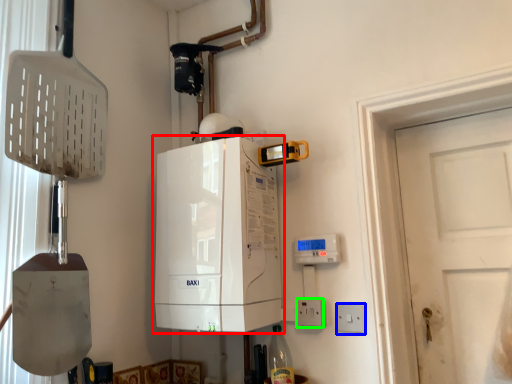
Question: Which object is positioned closest to home appliance (highlighted by a red box)? Select from electric outlet (highlighted by a blue box) and electric outlet (highlighted by a green box).

Choices:
 (A) electric outlet
 (B) electric outlet

Answer: (B)